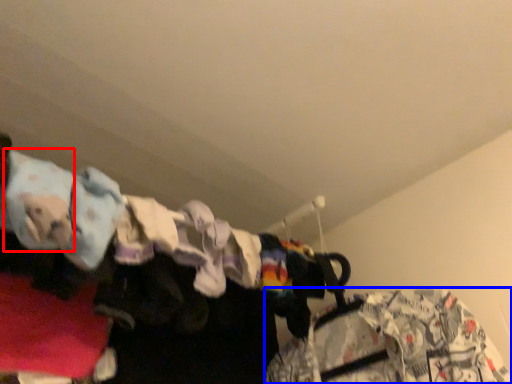
Question: Which object is closer to the camera taking this photo, clothing (highlighted by a red box) or clothing (highlighted by a blue box)?

Choices:
 (A) clothing
 (B) clothing

Answer: (A)